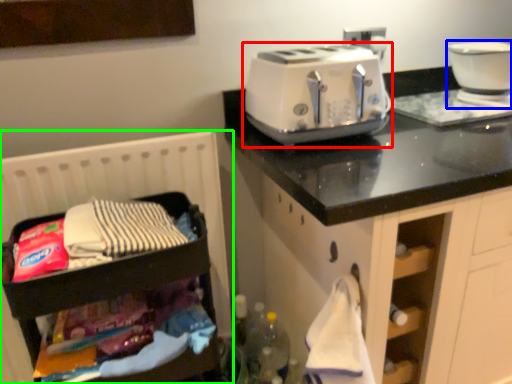
Question: Which object is the closest to the toaster (highlighted by a red box)? Choose among these: home appliance (highlighted by a blue box) or infant bed (highlighted by a green box).

Choices:
 (A) home appliance
 (B) infant bed

Answer: (B)